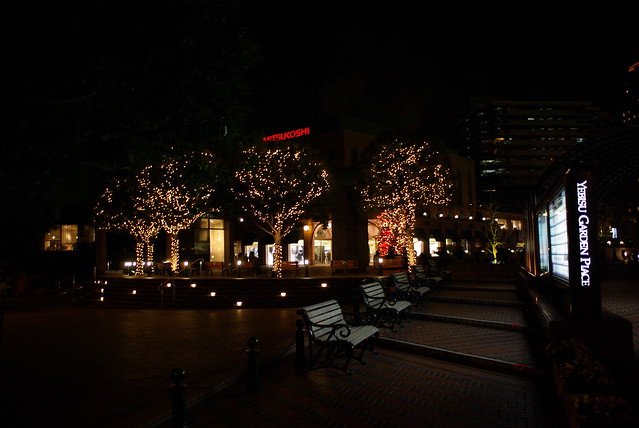
Image resolution: width=639 pixels, height=428 pixels. Identify the location of lit windows. (250, 245), (266, 247), (317, 249), (420, 247), (431, 243), (560, 235), (542, 236), (82, 232), (45, 241).